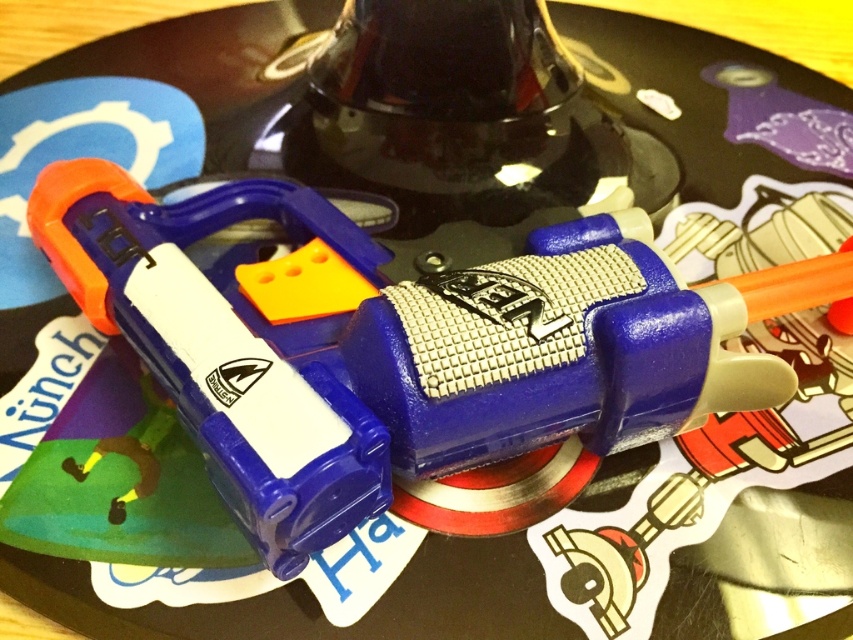
You are a child trying to choose between the blue plastic toy gun at center and the matte plastic toy gun at center. Which one is bigger?

The blue plastic toy gun at center is larger in size compared to the matte plastic toy gun at center.

You are trying to place both the blue plastic toy gun at center and the matte plastic toy gun at center on a shelf. If the shelf has a width of 20 cm, can both fit side by side?

The blue plastic toy gun at center might be wider than matte plastic toy gun at center, so it is uncertain if both can fit on the 20 cm shelf without overlapping. Measure their widths to confirm.

You are looking at a closeup of a toy blaster on a reflective surface. The coordinates given are for a point in the image. Which object is located at point [405,346]?

The point [405,346] indicates the blue plastic toy gun at center.